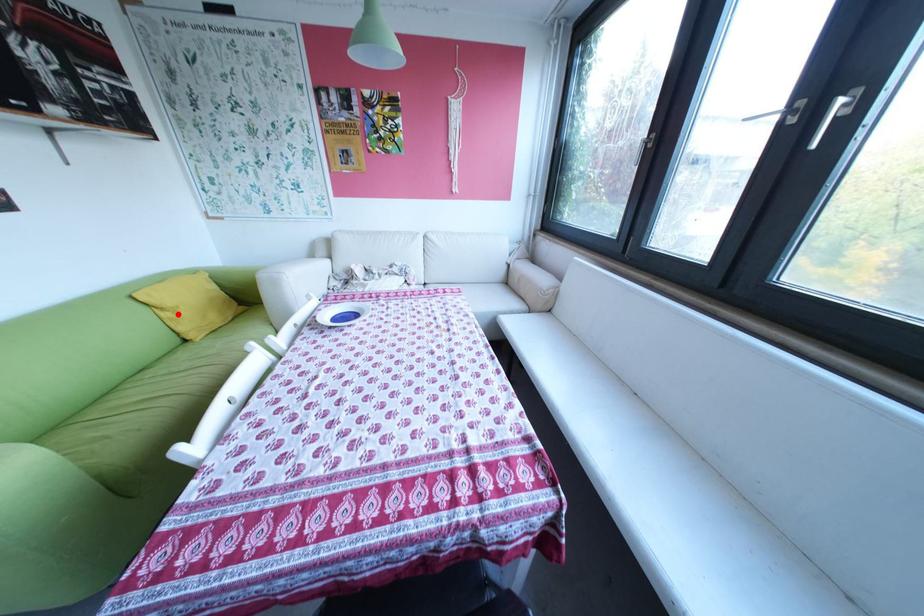
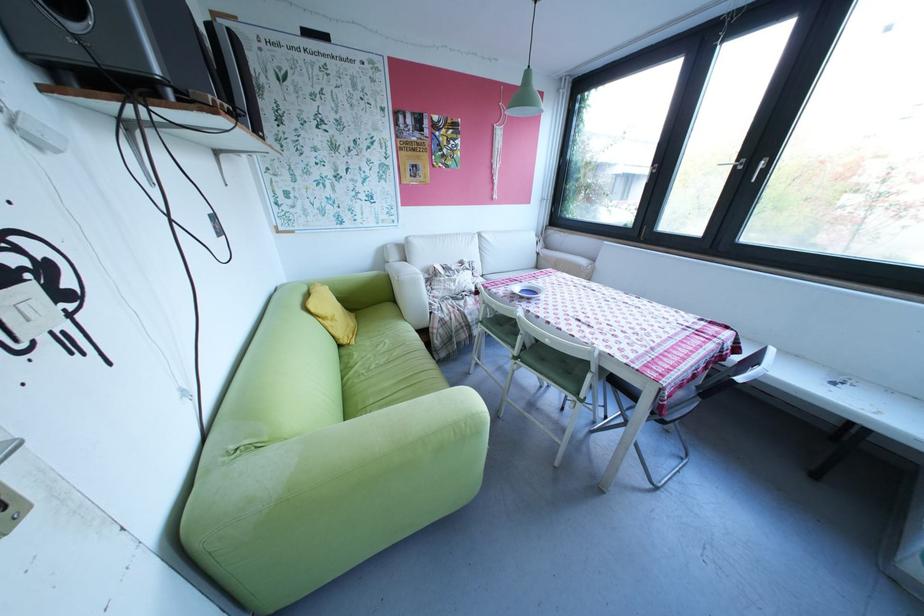
Question: I am providing you with two images of the same scene from different viewpoints. Image1 has a red point marked. In image2, the corresponding 3D location appears at what relative position? Reply with the corresponding letter.

Choices:
 (A) Closer
 (B) Farther

Answer: (A)